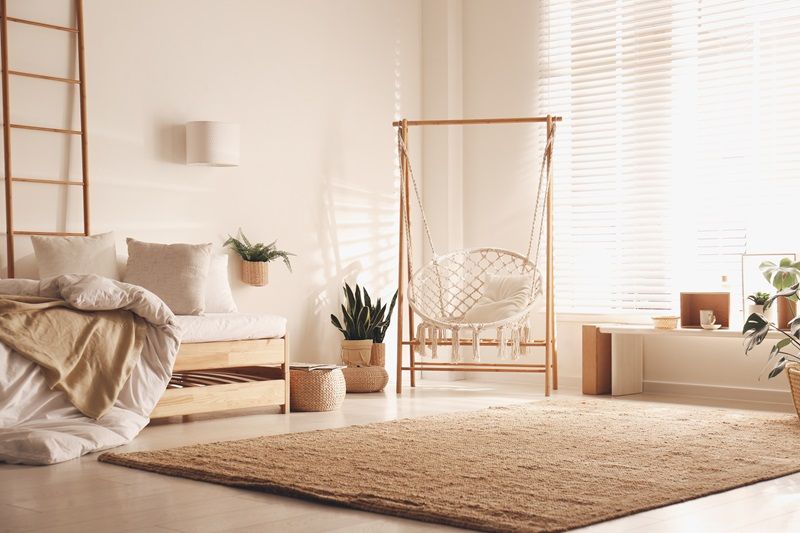
Identify the location of floor. pos(112,510).